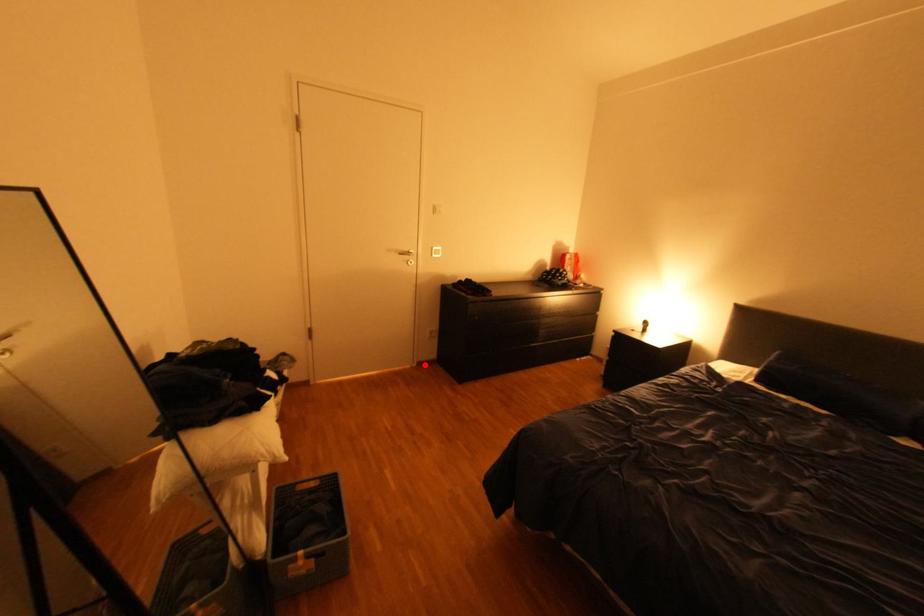
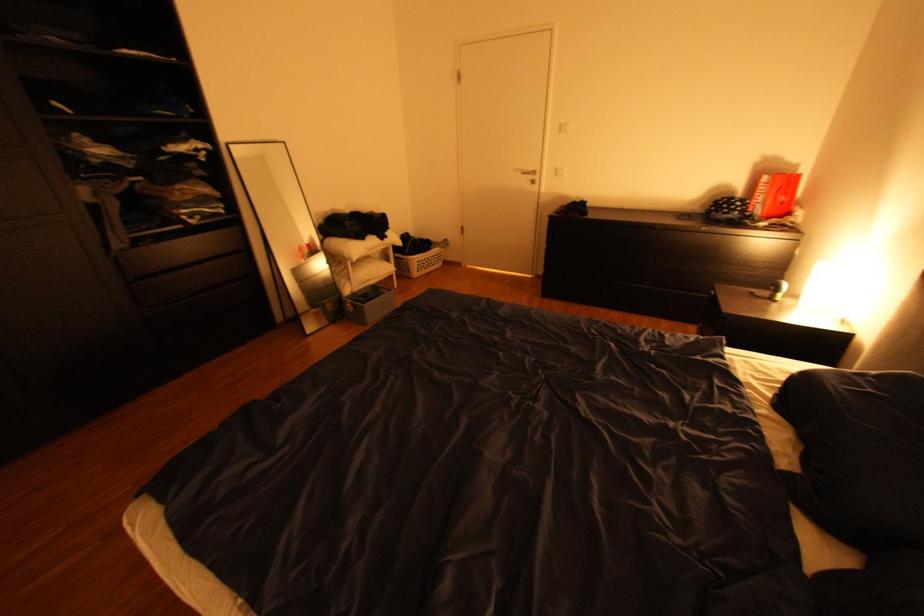
Locate, in the second image, the point that corresponds to the highlighted location in the first image.

(543, 276)